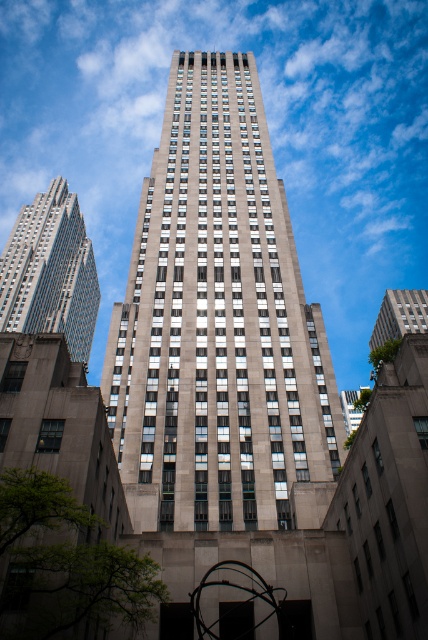
Does point (213, 332) come farther from viewer compared to point (86, 298)?

No, it is in front of (86, 298).

Which is in front, point (253, 472) or point (80, 237)?

Point (253, 472) is more forward.

What are the coordinates of `gray stone building at center` in the screenshot? It's located at (217, 324).

Is silver glass skyscraper at left shorter than gray stone building at upper right?

Incorrect, silver glass skyscraper at left's height does not fall short of gray stone building at upper right's.

At what (x,y) coordinates should I click in order to perform the action: click on silver glass skyscraper at left. Please return your answer as a coordinate pair (x, y). The height and width of the screenshot is (640, 428). Looking at the image, I should click on (50, 272).

Can you confirm if gray stone building at center is shorter than gray stone building at upper right?

No, gray stone building at center is not shorter than gray stone building at upper right.

This screenshot has width=428, height=640. What do you see at coordinates (217, 324) in the screenshot?
I see `gray stone building at center` at bounding box center [217, 324].

Is point (174, 513) more distant than point (422, 330)?

No, (174, 513) is in front of (422, 330).

Locate an element on the screen. gray stone building at center is located at coordinates (217, 324).